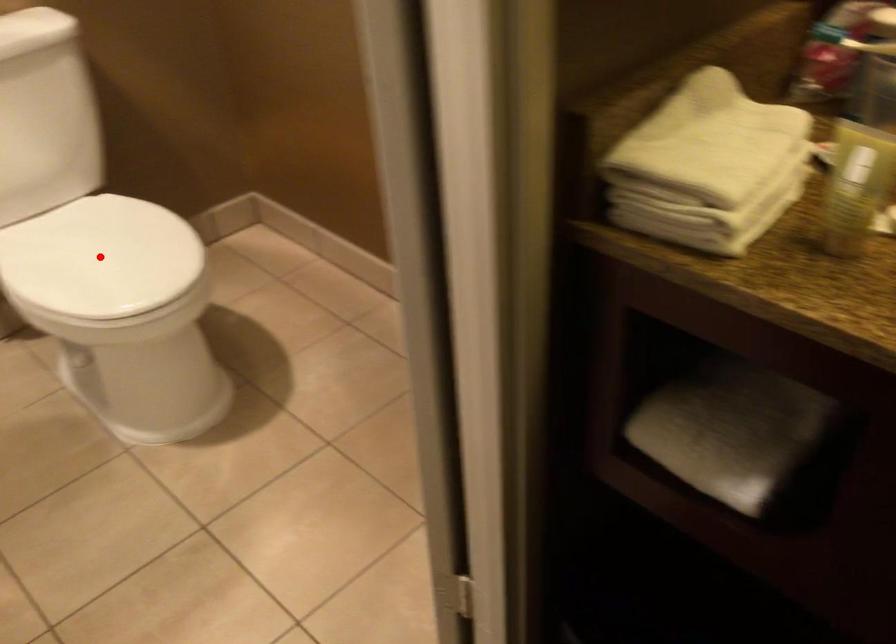
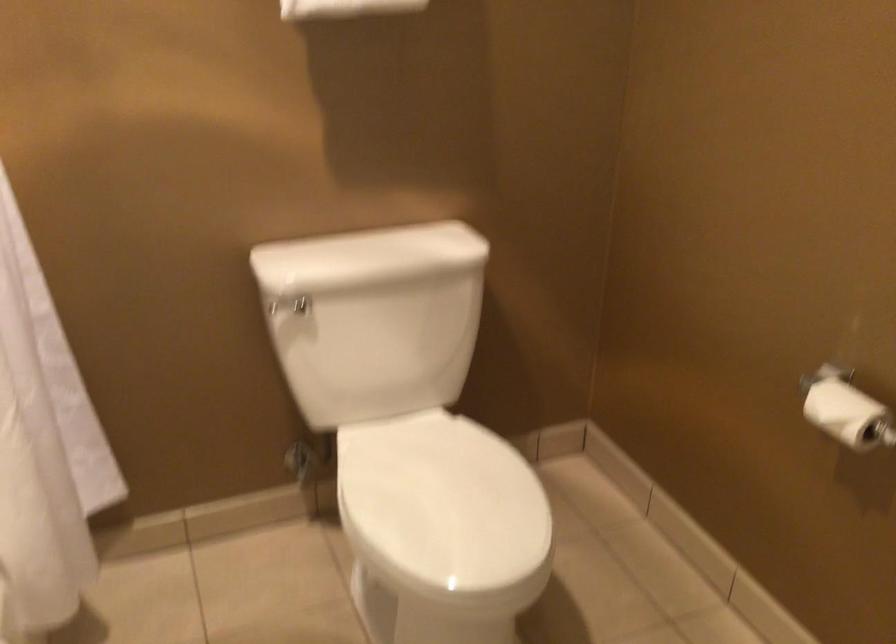
Where in the second image is the point corresponding to the highlighted location from the first image?

(442, 505)